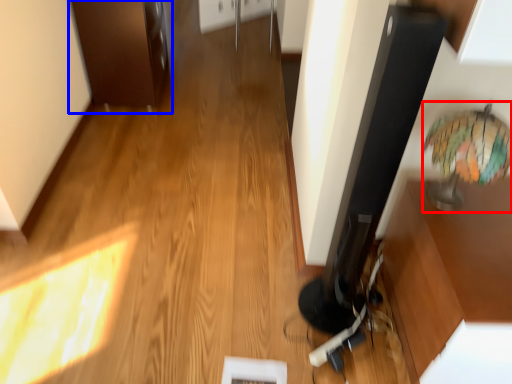
Question: Which object appears closest to the camera in this image, table lamp (highlighted by a red box) or cabinetry (highlighted by a blue box)?

Choices:
 (A) table lamp
 (B) cabinetry

Answer: (A)